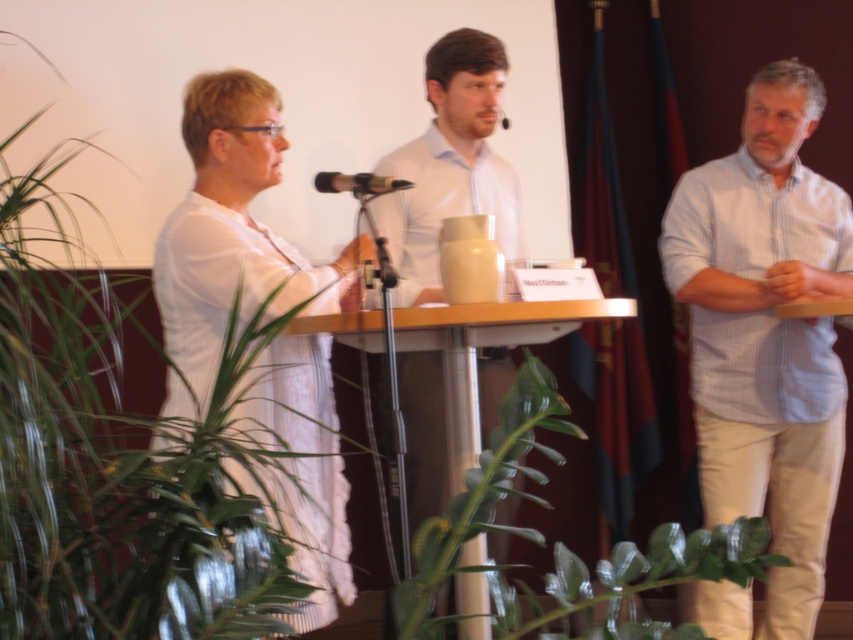
You are standing at the center of the room and want to place a new object at the same 2D location as the green leafy plant at left. What are the coordinates you should aim for?

The coordinates for the green leafy plant at left are at point (167, 438), so you should aim for those coordinates.

You are an attendee at the presentation and need to place a small note on the table in front of the podium. The note must be placed between the green leafy plant at left and the black matte microphone at center. Is there enough space between them to do this?

The green leafy plant at left is to the left of the black matte microphone at center, so there is space between them to place the note.

You are organizing a presentation and need to place a decorative item on the table. The table has limited space. Which object between the green glossy leaf at lower center and the black plastic microphone at center should you choose to ensure it fits better in a narrow space?

The black plastic microphone at center has a smaller width than the green glossy leaf at lower center, so it would fit better in a narrow space.